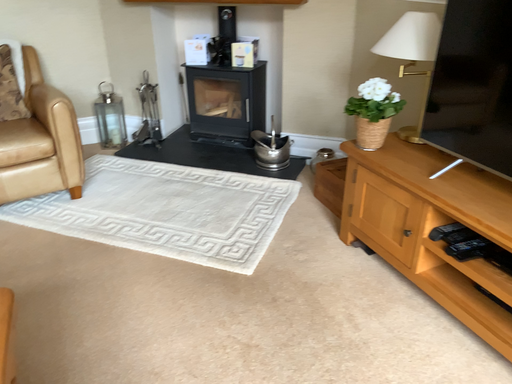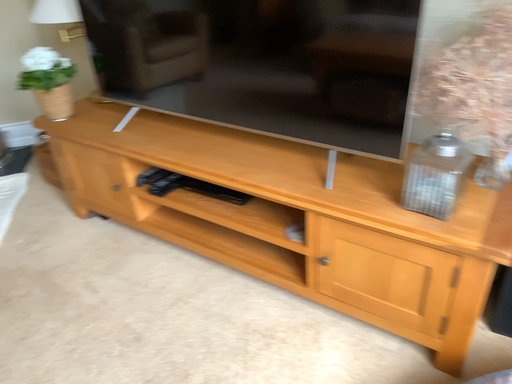
Question: Which way did the camera rotate in the video?

Choices:
 (A) rotated right
 (B) rotated left

Answer: (A)